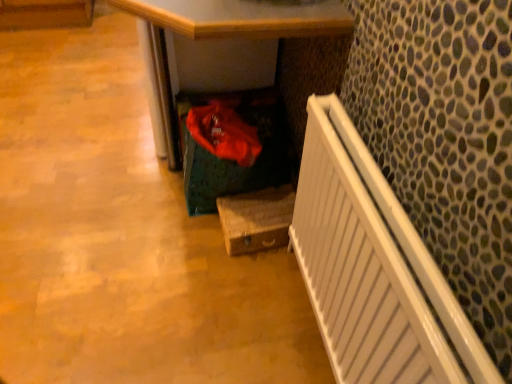
Question: From a real-world perspective, is wooden box at lower center below wooden at lower center?

Choices:
 (A) no
 (B) yes

Answer: (B)

Question: Is wooden box at lower center shorter than wooden at lower center?

Choices:
 (A) no
 (B) yes

Answer: (B)

Question: From the image's perspective, does wooden box at lower center appear higher than wooden at lower center?

Choices:
 (A) no
 (B) yes

Answer: (A)

Question: Is wooden box at lower center looking in the opposite direction of wooden at lower center?

Choices:
 (A) no
 (B) yes

Answer: (B)

Question: Is wooden box at lower center next to wooden at lower center and touching it?

Choices:
 (A) no
 (B) yes

Answer: (A)

Question: Is wooden at lower center inside wooden box at lower center?

Choices:
 (A) no
 (B) yes

Answer: (A)

Question: From the image's perspective, would you say wooden at lower center is positioned over wooden box at lower center?

Choices:
 (A) no
 (B) yes

Answer: (B)

Question: Is wooden at lower center further to camera compared to wooden box at lower center?

Choices:
 (A) yes
 (B) no

Answer: (B)

Question: Are wooden at lower center and wooden box at lower center making contact?

Choices:
 (A) no
 (B) yes

Answer: (A)

Question: Does wooden at lower center have a smaller size compared to wooden box at lower center?

Choices:
 (A) no
 (B) yes

Answer: (A)

Question: Is wooden at lower center thinner than wooden box at lower center?

Choices:
 (A) yes
 (B) no

Answer: (B)

Question: Is wooden at lower center to the left of wooden box at lower center from the viewer's perspective?

Choices:
 (A) no
 (B) yes

Answer: (B)

Question: Is wooden box at lower center wider than white glossy radiator at right?

Choices:
 (A) no
 (B) yes

Answer: (B)